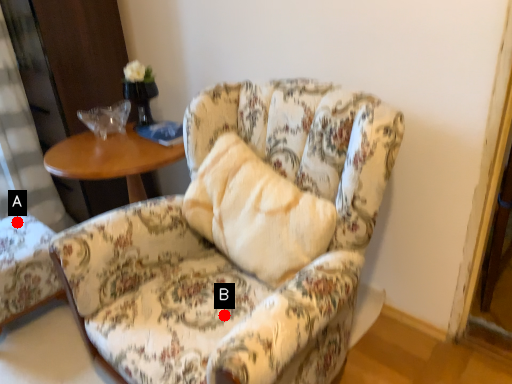
Question: Two points are circled on the image, labeled by A and B beside each circle. Which of the following is the closest to the observer?

Choices:
 (A) A is closer
 (B) B is closer

Answer: (B)